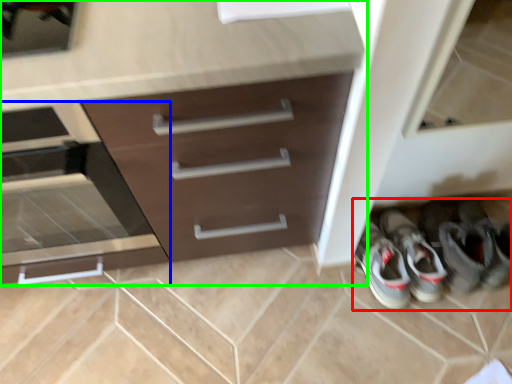
Question: Estimate the real-world distances between objects in this image. Which object is farther from footwear (highlighted by a red box), drawer (highlighted by a blue box) or chest of drawers (highlighted by a green box)?

Choices:
 (A) drawer
 (B) chest of drawers

Answer: (A)